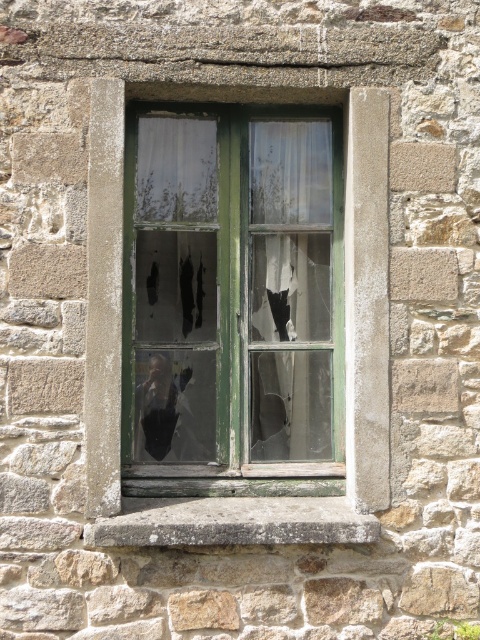
Looking at this image, you are standing in front of a stone wall with a window. There is a point marked at coordinates (232,300). What object is located at that point?

The point at coordinates (232,300) corresponds to the green wooden window at center.

You are an architect inspecting a building. You notice the green wooden window at center and the gray concrete at center. Which one has a larger area in the image?

The green wooden window at center is bigger than gray concrete at center, so the green wooden window at center has a larger area.

You are standing in front of the green wooden window at center and the gray concrete at center. Which object is closer to you?

The green wooden window at center is closer to you because the gray concrete at center is behind it.